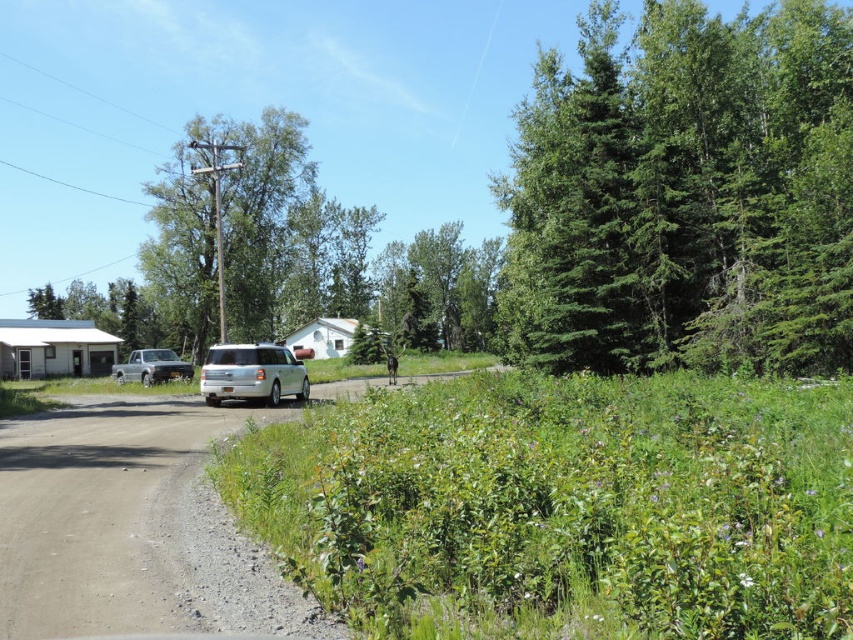
Question: Does green leafy shrubs at center have a greater width compared to silver metallic truck at left?

Choices:
 (A) no
 (B) yes

Answer: (A)

Question: Does white matte suv at center have a smaller size compared to silver metallic truck at left?

Choices:
 (A) no
 (B) yes

Answer: (B)

Question: Considering the relative positions of dirt/gravel road at center and green leafy tree at center in the image provided, where is dirt/gravel road at center located with respect to green leafy tree at center?

Choices:
 (A) right
 (B) left

Answer: (A)

Question: Among these objects, which one is farthest from the camera?

Choices:
 (A) white matte suv at center
 (B) green leafy tree at center
 (C) silver metallic truck at left
 (D) green leafy shrubs at center

Answer: (B)

Question: Among these points, which one is nearest to the camera?

Choices:
 (A) (602, 355)
 (B) (724, 460)
 (C) (221, 376)

Answer: (B)

Question: Which point appears farthest from the camera in this image?

Choices:
 (A) (178, 198)
 (B) (780, 244)
 (C) (166, 362)

Answer: (A)